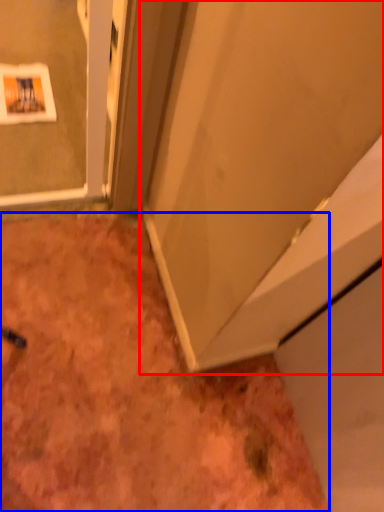
Question: Which of the following is the farthest to the observer, door (highlighted by a red box) or dirt (highlighted by a blue box)?

Choices:
 (A) door
 (B) dirt

Answer: (B)